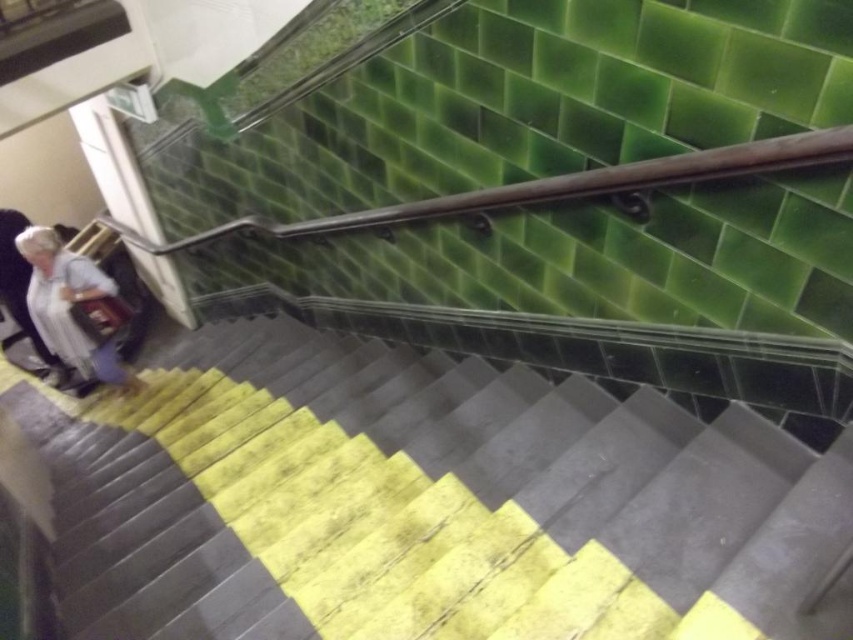
Is yellow rubber steps at lower left smaller than light gray fabric coat at left?

No, yellow rubber steps at lower left is not smaller than light gray fabric coat at left.

Between yellow rubber steps at lower left and light gray fabric coat at left, which one is positioned higher?

light gray fabric coat at left is above.

Where is `yellow rubber steps at lower left`? yellow rubber steps at lower left is located at coordinates (427, 500).

This screenshot has width=853, height=640. I want to click on wooden handrail at upper center, so click(x=547, y=188).

Can you confirm if wooden handrail at upper center is positioned above light gray fabric coat at left?

Indeed, wooden handrail at upper center is positioned over light gray fabric coat at left.

Who is more forward, (708, 150) or (90, 344)?

Point (708, 150) is in front.

Identify the location of wooden handrail at upper center. (547, 188).

Is point (473, 452) closer to camera compared to point (553, 198)?

No, it is not.

Consider the image. Who is taller, yellow rubber steps at lower left or wooden handrail at upper center?

Standing taller between the two is yellow rubber steps at lower left.

This screenshot has width=853, height=640. Find the location of `yellow rubber steps at lower left`. yellow rubber steps at lower left is located at coordinates (427, 500).